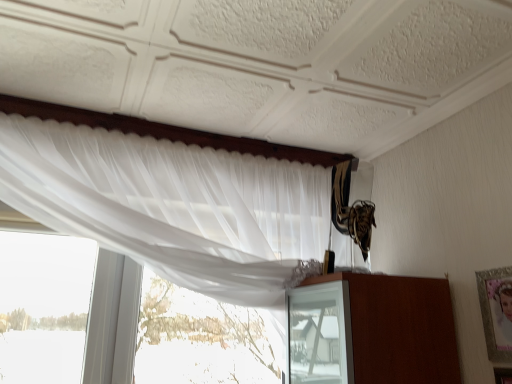
Question: From a real-world perspective, is white sheer curtain at upper left over silver metallic picture frame at upper right?

Choices:
 (A) no
 (B) yes

Answer: (B)

Question: Does white sheer curtain at upper left appear on the left side of silver metallic picture frame at upper right?

Choices:
 (A) no
 (B) yes

Answer: (B)

Question: Is silver metallic picture frame at upper right a part of white sheer curtain at upper left?

Choices:
 (A) no
 (B) yes

Answer: (A)

Question: Is white sheer curtain at upper left smaller than silver metallic picture frame at upper right?

Choices:
 (A) yes
 (B) no

Answer: (B)

Question: Considering the relative sizes of white sheer curtain at upper left and silver metallic picture frame at upper right in the image provided, is white sheer curtain at upper left shorter than silver metallic picture frame at upper right?

Choices:
 (A) yes
 (B) no

Answer: (B)

Question: Is white sheer curtain at upper left to the right of silver metallic picture frame at upper right from the viewer's perspective?

Choices:
 (A) no
 (B) yes

Answer: (A)

Question: Is silver metallic picture frame at upper right outside of white sheer curtain at upper left?

Choices:
 (A) no
 (B) yes

Answer: (B)

Question: From the image's perspective, is silver metallic picture frame at upper right below white sheer curtain at upper left?

Choices:
 (A) yes
 (B) no

Answer: (A)

Question: Does silver metallic picture frame at upper right turn towards white sheer curtain at upper left?

Choices:
 (A) no
 (B) yes

Answer: (A)

Question: Would you say silver metallic picture frame at upper right is a long distance from white sheer curtain at upper left?

Choices:
 (A) yes
 (B) no

Answer: (B)

Question: Can you confirm if silver metallic picture frame at upper right is thinner than white sheer curtain at upper left?

Choices:
 (A) yes
 (B) no

Answer: (A)

Question: Is silver metallic picture frame at upper right closer to the viewer compared to white sheer curtain at upper left?

Choices:
 (A) no
 (B) yes

Answer: (A)

Question: In terms of size, does silver metallic picture frame at upper right appear bigger or smaller than white sheer curtain at upper left?

Choices:
 (A) big
 (B) small

Answer: (B)